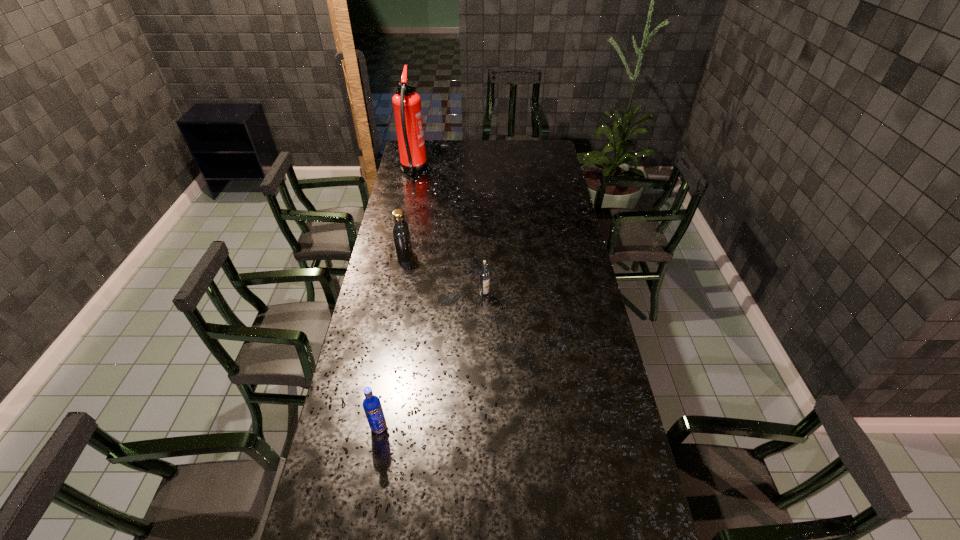
In order to click on the farthest object in this screenshot , I will do `click(407, 104)`.

The image size is (960, 540). I want to click on fire extinguisher, so click(407, 104).

Identify the location of the farthest vodka. Image resolution: width=960 pixels, height=540 pixels. (401, 234).

Locate an element on the screen. the nearest object is located at coordinates (372, 406).

The width and height of the screenshot is (960, 540). In order to click on the shortest vodka in this screenshot , I will do pyautogui.click(x=484, y=274).

Locate an element on the screen. This screenshot has height=540, width=960. the rightmost object is located at coordinates point(484,274).

Where is `vacant space located at the nozzle of the farthest object`? The height and width of the screenshot is (540, 960). vacant space located at the nozzle of the farthest object is located at coordinates (474, 171).

This screenshot has height=540, width=960. In order to click on vacant space located 0.370m on the front-facing side of the second farthest object in this screenshot , I will do `click(500, 255)`.

Find the location of a particular element. The image size is (960, 540). vacant point located on the right of the nearest vodka is located at coordinates point(485,427).

The height and width of the screenshot is (540, 960). In order to click on vacant space positioned 0.190m on the label of the rightmost vodka in this screenshot , I will do `click(485, 338)`.